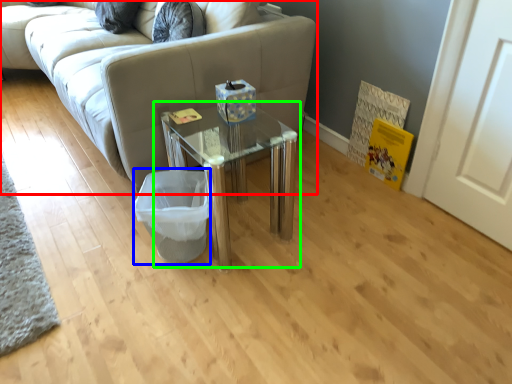
Question: Which object is the farthest from studio couch (highlighted by a red box)? Choose among these: laundry basket (highlighted by a blue box) or table (highlighted by a green box).

Choices:
 (A) laundry basket
 (B) table

Answer: (A)